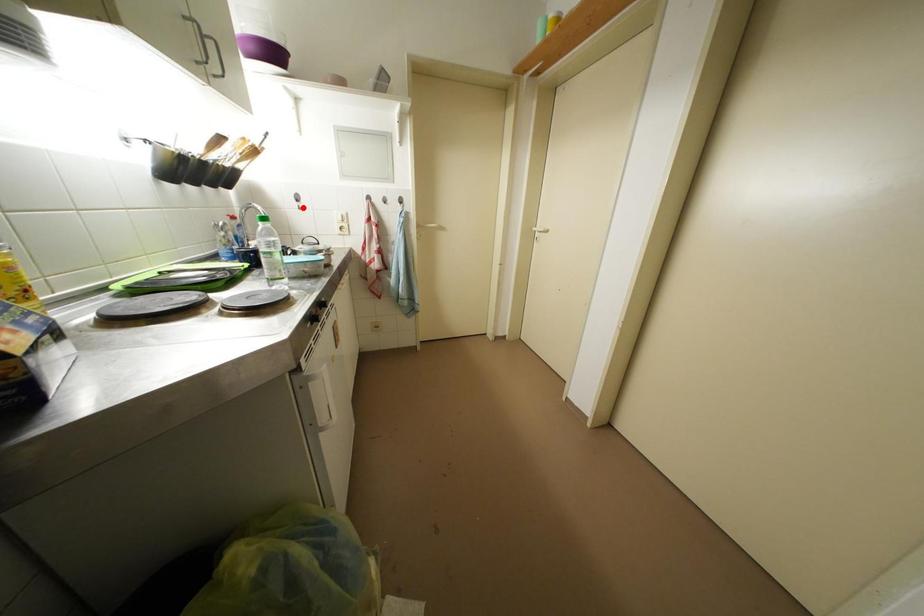
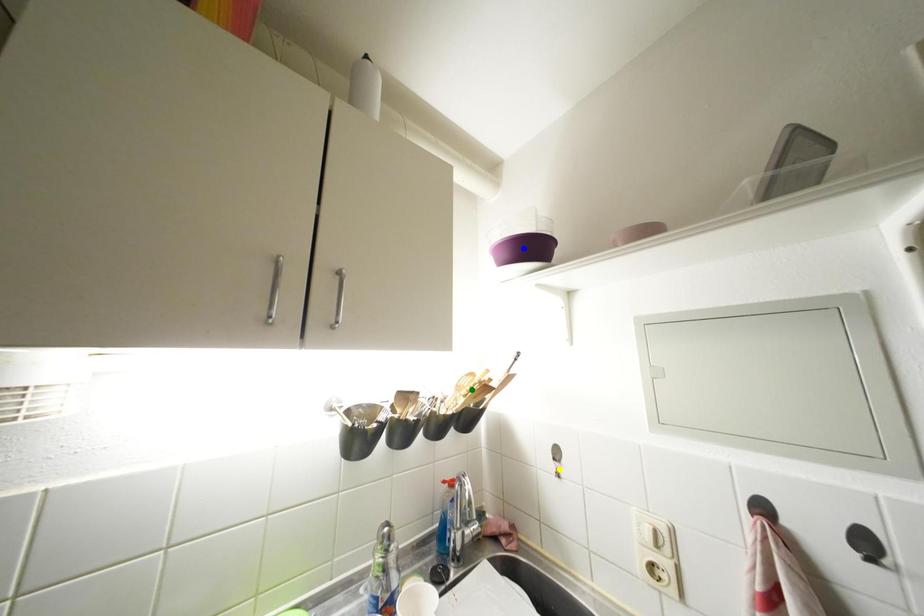
Question: I am providing you with two images of the same scene from different viewpoints. A red point is marked on the first image. You are given multiple points on the second image. Which spot in image 2 lines up with the point in image 1?

Choices:
 (A) yellow point
 (B) blue point
 (C) green point

Answer: (A)